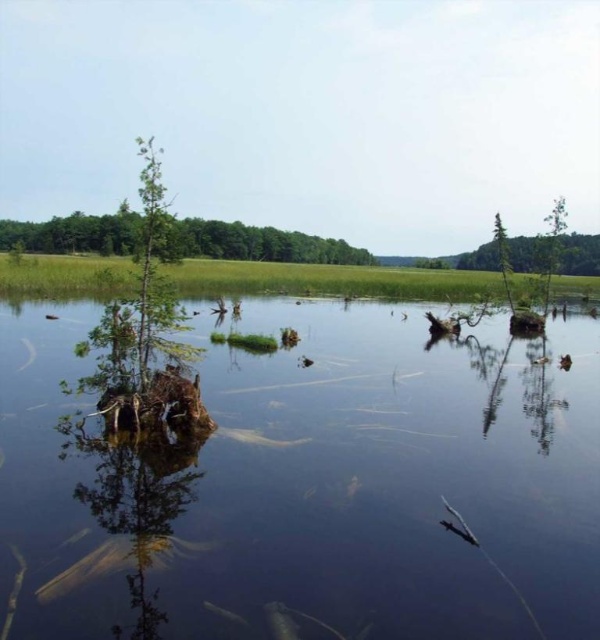
Question: Is clear water at center above translucent clear fish at lower center?

Choices:
 (A) yes
 (B) no

Answer: (A)

Question: Among these points, which one is nearest to the camera?

Choices:
 (A) (376, 451)
 (B) (241, 621)

Answer: (B)

Question: Which of the following is the farthest from the observer?

Choices:
 (A) green matte tree at upper center
 (B) clear water at center
 (C) translucent greenish fish at center

Answer: (C)

Question: Which of the following is the closest to the observer?

Choices:
 (A) translucent clear fish at lower center
 (B) green matte tree at upper center
 (C) translucent greenish fish at center

Answer: (A)

Question: Can you confirm if clear water at center is positioned to the right of translucent clear fish at lower center?

Choices:
 (A) yes
 (B) no

Answer: (B)

Question: Can you confirm if translucent greenish fish at center is wider than translucent clear fish at lower center?

Choices:
 (A) no
 (B) yes

Answer: (B)